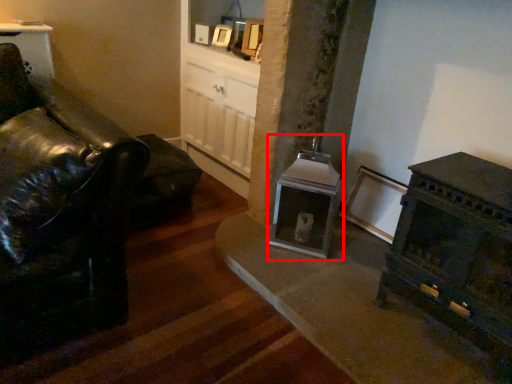
Question: From the image's perspective, where is fireplace (annotated by the red box) located relative to picture frame?

Choices:
 (A) above
 (B) below

Answer: (B)